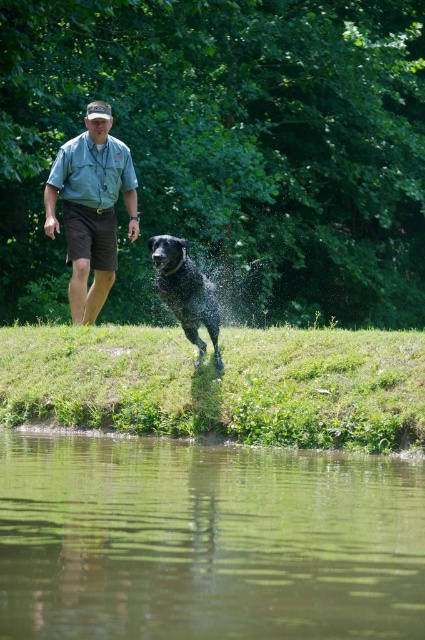
Question: Is denim shirt at left in front of shiny black dog at center?

Choices:
 (A) yes
 (B) no

Answer: (B)

Question: Which point is farther to the camera?

Choices:
 (A) shiny black dog at center
 (B) denim shirt at left

Answer: (B)

Question: Based on their relative distances, which object is nearer to the greenish-brown water at lower center?

Choices:
 (A) shiny black dog at center
 (B) denim shirt at left

Answer: (A)

Question: Which object appears closest to the camera in this image?

Choices:
 (A) denim shirt at left
 (B) shiny black dog at center

Answer: (B)

Question: Can you confirm if denim shirt at left is positioned above shiny black dog at center?

Choices:
 (A) yes
 (B) no

Answer: (A)

Question: Can you confirm if denim shirt at left is smaller than shiny black dog at center?

Choices:
 (A) no
 (B) yes

Answer: (A)